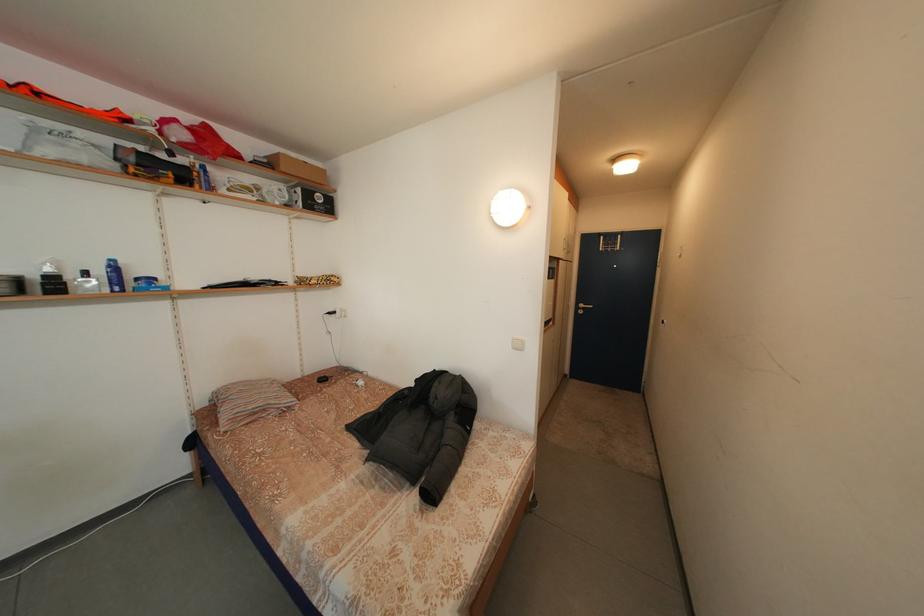
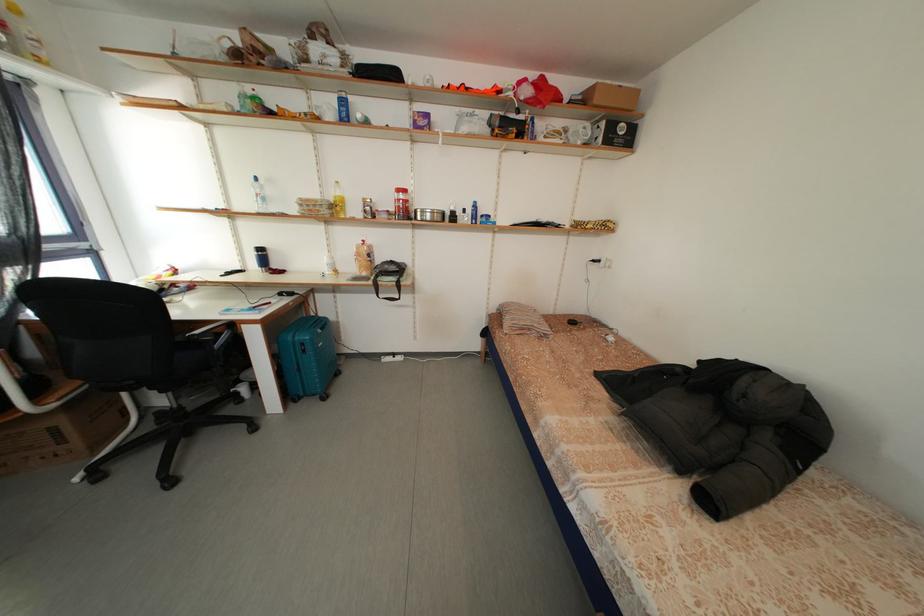
Question: The camera is either moving clockwise (left) or counter-clockwise (right) around the object. The first image is from the beginning of the video and the second image is from the end. Is the camera moving left or right when shooting the video?

Choices:
 (A) Left
 (B) Right

Answer: (B)